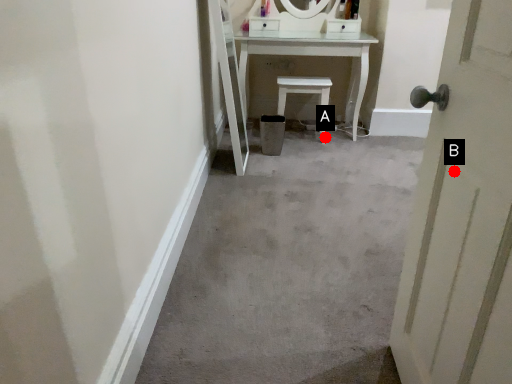
Question: Two points are circled on the image, labeled by A and B beside each circle. Which point is closer to the camera taking this photo?

Choices:
 (A) A is closer
 (B) B is closer

Answer: (B)